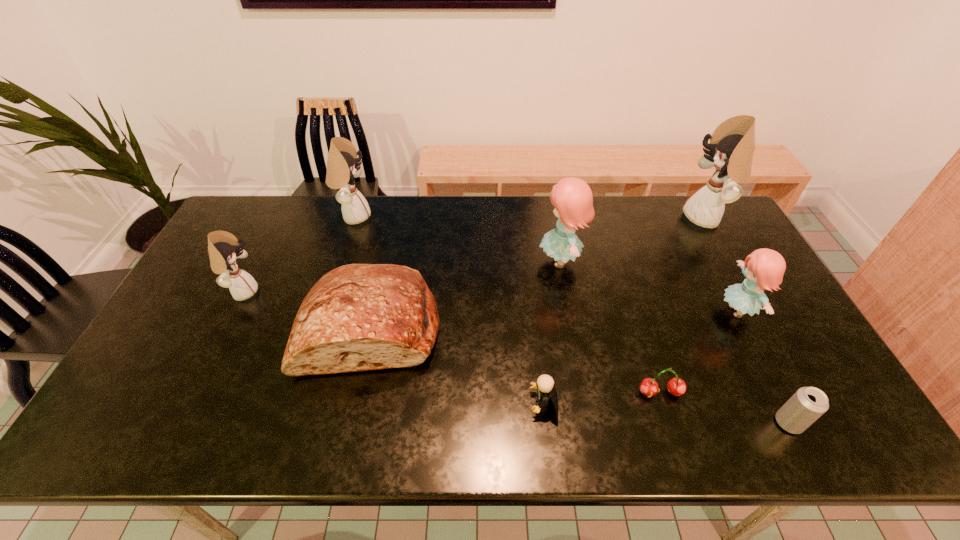
Where is `vacant point located between the beer can and the Lego`? This screenshot has height=540, width=960. vacant point located between the beer can and the Lego is located at coordinates (666, 413).

Locate an element on the screen. The height and width of the screenshot is (540, 960). free space between the beer can and the fourth doll from right to left is located at coordinates (571, 320).

This screenshot has width=960, height=540. I want to click on the eighth closest object to the Lego, so click(223, 247).

Select which object is the seventh closest to the tallest doll. Please provide its 2D coordinates. Your answer should be formatted as a tuple, i.e. [(x, y)], where the tuple contains the x and y coordinates of a point satisfying the conditions above.

[(343, 166)]

Locate an element on the screen. This screenshot has height=540, width=960. the fourth closest doll to the second black doll from right to left is located at coordinates (732, 144).

Identify which doll is the second nearest to the leftmost doll. Please provide its 2D coordinates. Your answer should be formatted as a tuple, i.e. [(x, y)], where the tuple contains the x and y coordinates of a point satisfying the conditions above.

[(572, 198)]

I want to click on black doll that can be found as the second closest to the fourth doll from right to left, so click(732, 144).

Where is `black doll that stands as the closest to the smaller blue doll`? The height and width of the screenshot is (540, 960). black doll that stands as the closest to the smaller blue doll is located at coordinates (732, 144).

What are the coordinates of `vacant area in the image that satisfies the following two spatial constraints: 1. on the front-facing side of the Lego; 2. on the left side of the beer can` in the screenshot? It's located at (546, 423).

You are a GUI agent. You are given a task and a screenshot of the screen. Output one action in this format:
    pyautogui.click(x=<x>, y=<y>)
    Task: Click on the vacant space that satisfies the following two spatial constraints: 1. at the front face of the rightmost black doll; 2. with stems pointing upwards on the red cherry
    
    Given the screenshot: What is the action you would take?
    pyautogui.click(x=804, y=393)